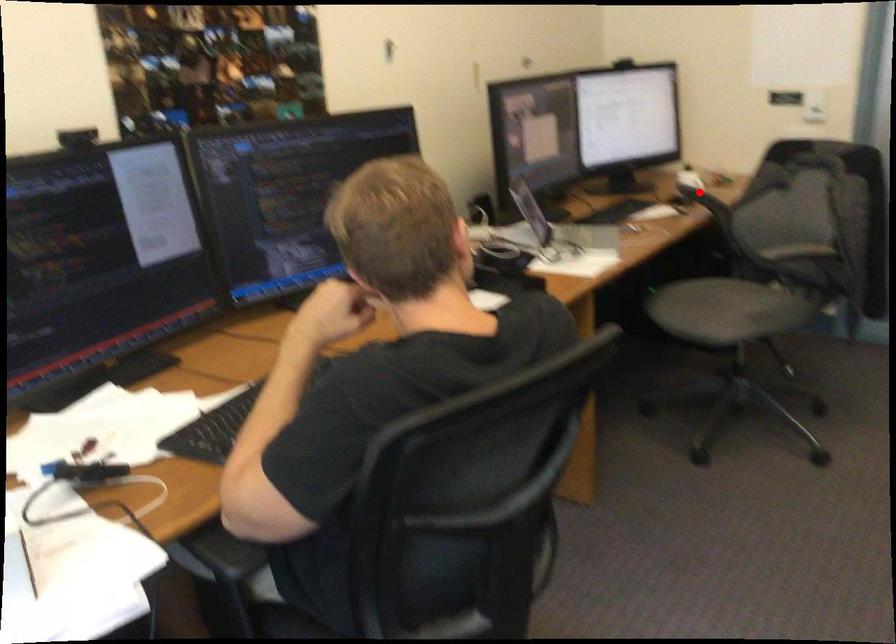
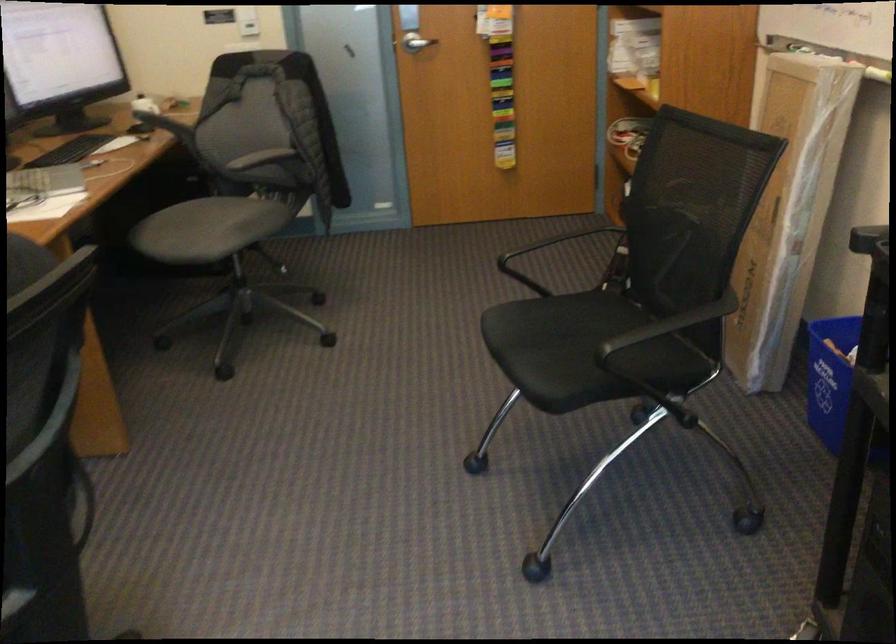
Where in the second image is the point corresponding to the highlighted location from the first image?

(158, 120)